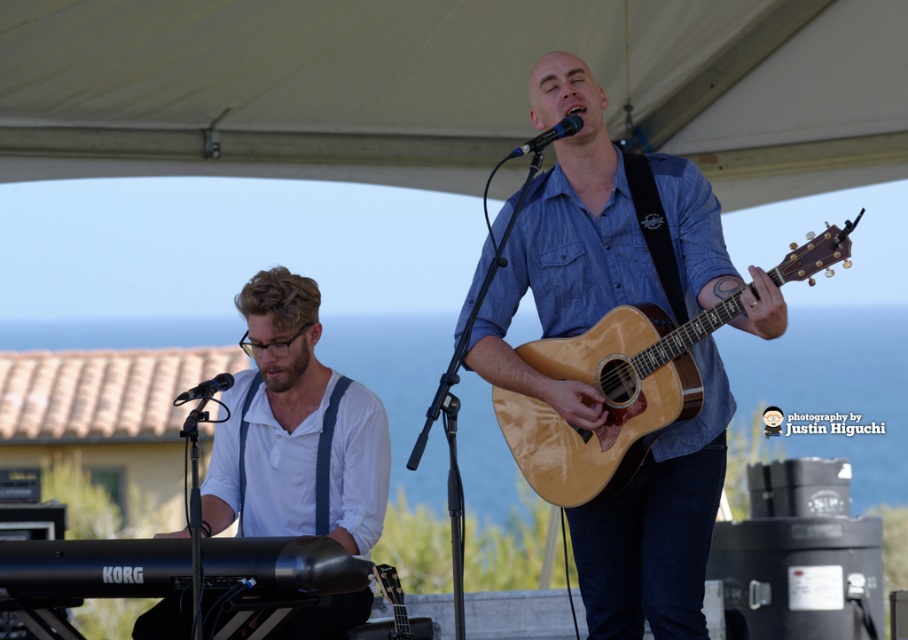
You are a photographer at this event and need to capture a closeup shot of both the white cotton shirt at left and the glossy wood guitar at center. Your camera has a maximum focus range that can only capture objects within 20 inches of each other. Can you fit both objects in the same closeup shot?

The white cotton shirt at left and the glossy wood guitar at center are 23.00 inches apart from each other. Since the distance exceeds the camera maximum focus range of 20 inches, you cannot fit both objects in the same closeup shot.

You are a photographer at the live musical performance. You want to capture a photo of the white cotton shirt at left. Based on its position coordinates, where should you aim your camera?

The white cotton shirt at left is located at coordinates point (295, 429), so you should aim your camera towards that position to capture it.

Consider the image. You are a photographer at the event and need to position your camera to capture both the denim shirt at center and the white cotton shirt at left in the same frame. Considering their heights, which one will appear larger in the photo?

The denim shirt at center is much taller than the white cotton shirt at left, so it will appear larger in the photo.